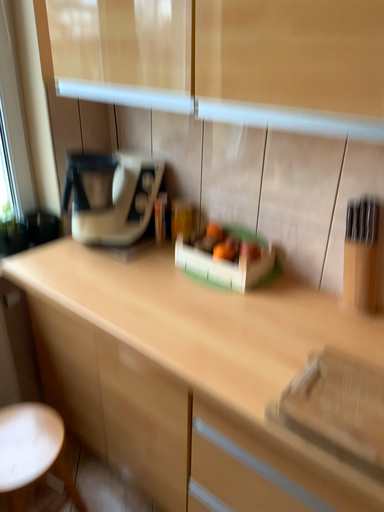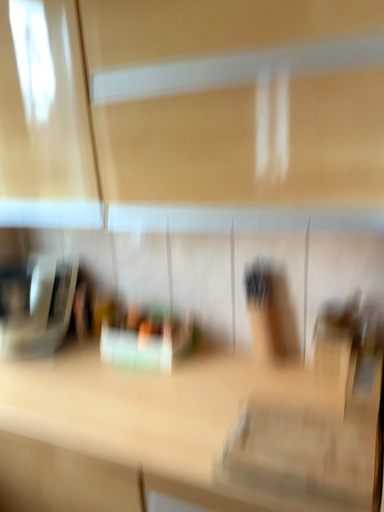
Question: Which way did the camera rotate in the video?

Choices:
 (A) rotated upward
 (B) rotated downward

Answer: (A)